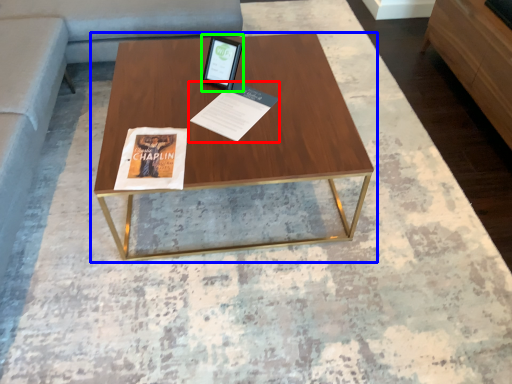
Question: Which object is the closest to the magazine (highlighted by a red box)? Choose among these: coffee table (highlighted by a blue box) or tablet computer (highlighted by a green box).

Choices:
 (A) coffee table
 (B) tablet computer

Answer: (B)